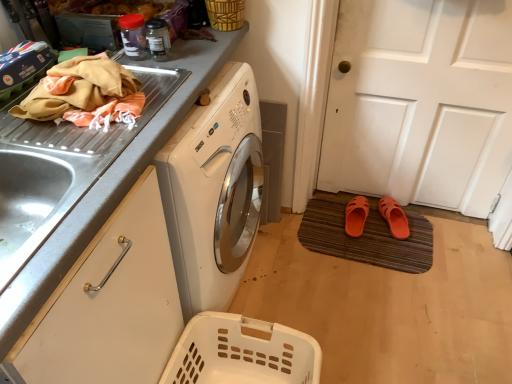
Where is `free space in front of orange fabric at upper left`? The width and height of the screenshot is (512, 384). free space in front of orange fabric at upper left is located at coordinates (78, 160).